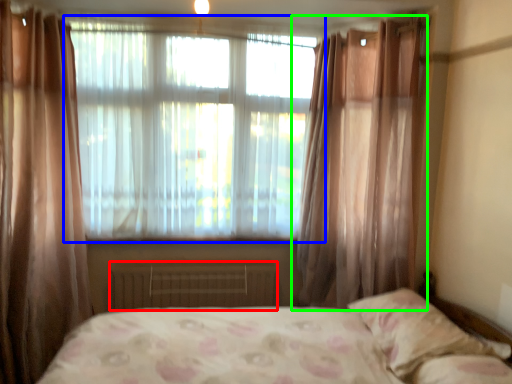
Question: Which is nearer to the radiator (highlighted by a red box)? window (highlighted by a blue box) or curtain (highlighted by a green box).

Choices:
 (A) window
 (B) curtain

Answer: (A)